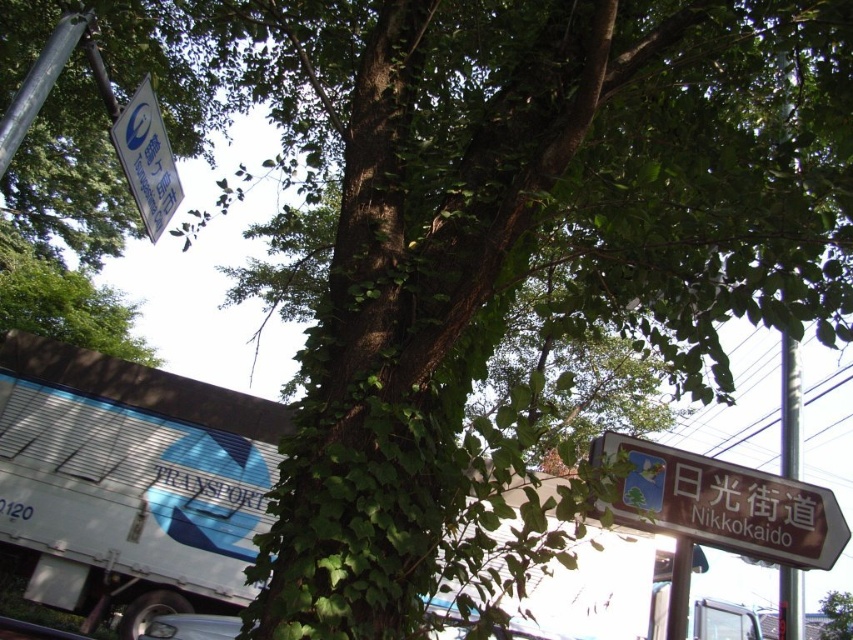
Question: Observing the image, what is the correct spatial positioning of white plastic sign at upper left in reference to green leafy tree at center?

Choices:
 (A) above
 (B) below

Answer: (A)

Question: Which point is farther from the camera taking this photo?

Choices:
 (A) tap(114, 529)
 (B) tap(836, 616)
 (C) tap(786, 572)
 (D) tap(160, 161)

Answer: (B)

Question: Is white metallic truck at lower left thinner than green leafy tree at center?

Choices:
 (A) yes
 (B) no

Answer: (B)

Question: Which object appears farthest from the camera in this image?

Choices:
 (A) white plastic sign at upper left
 (B) brown wooden signpost at right
 (C) white metallic truck at lower left

Answer: (C)

Question: Which object is farther from the camera taking this photo?

Choices:
 (A) brown wooden sign at lower right
 (B) white metallic truck at lower left

Answer: (B)

Question: Can you confirm if white metallic truck at lower left is positioned to the right of brown wooden sign at lower right?

Choices:
 (A) yes
 (B) no

Answer: (B)